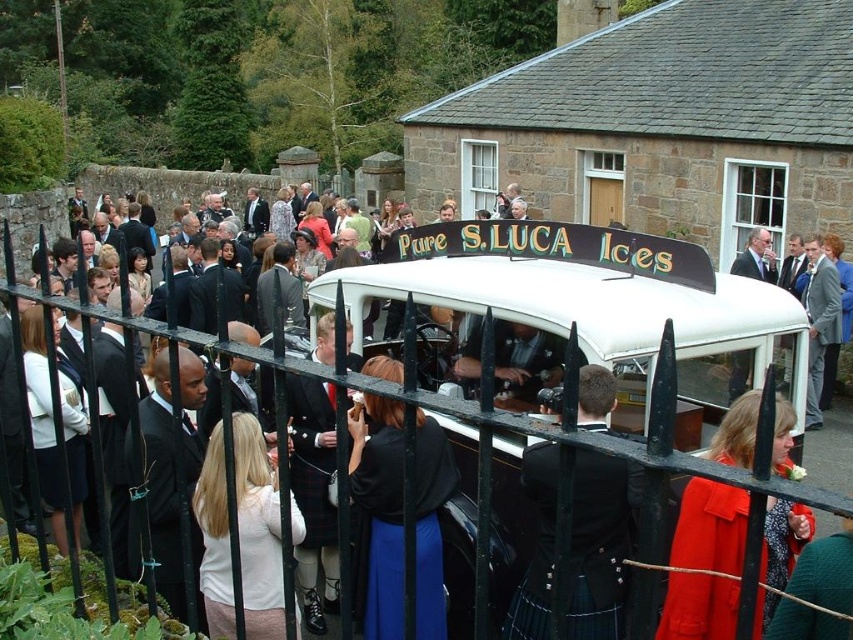
Question: In this image, where is black metal fence at center located relative to blue satin dress at center?

Choices:
 (A) left
 (B) right

Answer: (A)

Question: Estimate the real-world distances between objects in this image. Which object is farther from the blue satin dress at center?

Choices:
 (A) light beige sweater at center
 (B) black leather kilt at center
 (C) light blue suit at center
 (D) matte black kilt at center

Answer: (C)

Question: Where is blue satin dress at center located in relation to black suit at center in the image?

Choices:
 (A) left
 (B) right

Answer: (B)

Question: Can you confirm if red wool coat at center is positioned below black suit at center?

Choices:
 (A) yes
 (B) no

Answer: (A)

Question: Which point is closer to the camera?

Choices:
 (A) blue satin dress at center
 (B) matte black kilt at center
 (C) light blue suit at center

Answer: (A)

Question: Which point appears closest to the camera in this image?

Choices:
 (A) (496, 461)
 (B) (178, 497)
 (C) (788, 513)

Answer: (B)